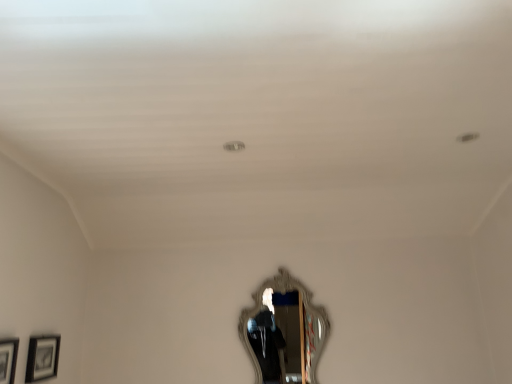
Question: Is matte black picture frame at lower left, which is the 2th picture frame in back-to-front order, at the left side of silver ornate mirror at center?

Choices:
 (A) yes
 (B) no

Answer: (A)

Question: From the image's perspective, is matte black picture frame at lower left, the first picture frame from the front, under silver ornate mirror at center?

Choices:
 (A) yes
 (B) no

Answer: (B)

Question: Considering the relative positions of matte black picture frame at lower left, which is the 2th picture frame in back-to-front order, and silver ornate mirror at center in the image provided, is matte black picture frame at lower left, which is the 2th picture frame in back-to-front order, behind silver ornate mirror at center?

Choices:
 (A) yes
 (B) no

Answer: (B)

Question: Does matte black picture frame at lower left, the first picture frame from the front, have a lesser height compared to silver ornate mirror at center?

Choices:
 (A) no
 (B) yes

Answer: (B)

Question: From the image's perspective, is matte black picture frame at lower left, the first picture frame from the front, over silver ornate mirror at center?

Choices:
 (A) no
 (B) yes

Answer: (B)

Question: In the image, is matte black picture frame at lower left, the 1th picture frame from the back, positioned in front of or behind silver ornate mirror at center?

Choices:
 (A) front
 (B) behind

Answer: (A)

Question: Is matte black picture frame at lower left, the 1th picture frame from the back, inside the boundaries of silver ornate mirror at center, or outside?

Choices:
 (A) inside
 (B) outside

Answer: (B)

Question: Is point (55, 354) closer or farther from the camera than point (271, 309)?

Choices:
 (A) closer
 (B) farther

Answer: (A)

Question: From their relative heights in the image, would you say matte black picture frame at lower left, the 1th picture frame from the back, is taller or shorter than silver ornate mirror at center?

Choices:
 (A) tall
 (B) short

Answer: (B)

Question: Considering the relative positions of matte black picture frame at lower left, which is the 2th picture frame in back-to-front order, and silver ornate mirror at center in the image provided, is matte black picture frame at lower left, which is the 2th picture frame in back-to-front order, to the left or to the right of silver ornate mirror at center?

Choices:
 (A) left
 (B) right

Answer: (A)

Question: In terms of size, does matte black picture frame at lower left, which is the 2th picture frame in back-to-front order, appear bigger or smaller than silver ornate mirror at center?

Choices:
 (A) small
 (B) big

Answer: (A)

Question: Does point (10, 339) appear closer or farther from the camera than point (323, 307)?

Choices:
 (A) closer
 (B) farther

Answer: (A)

Question: Is matte black picture frame at lower left, the first picture frame from the front, inside the boundaries of silver ornate mirror at center, or outside?

Choices:
 (A) outside
 (B) inside

Answer: (A)

Question: Is matte black picture frame at lower left, marked as the second picture frame in a front-to-back arrangement, taller or shorter than matte black picture frame at lower left, which is the 2th picture frame in back-to-front order?

Choices:
 (A) tall
 (B) short

Answer: (B)

Question: From the image's perspective, is matte black picture frame at lower left, the 1th picture frame from the back, above or below matte black picture frame at lower left, which is the 2th picture frame in back-to-front order?

Choices:
 (A) below
 (B) above

Answer: (A)